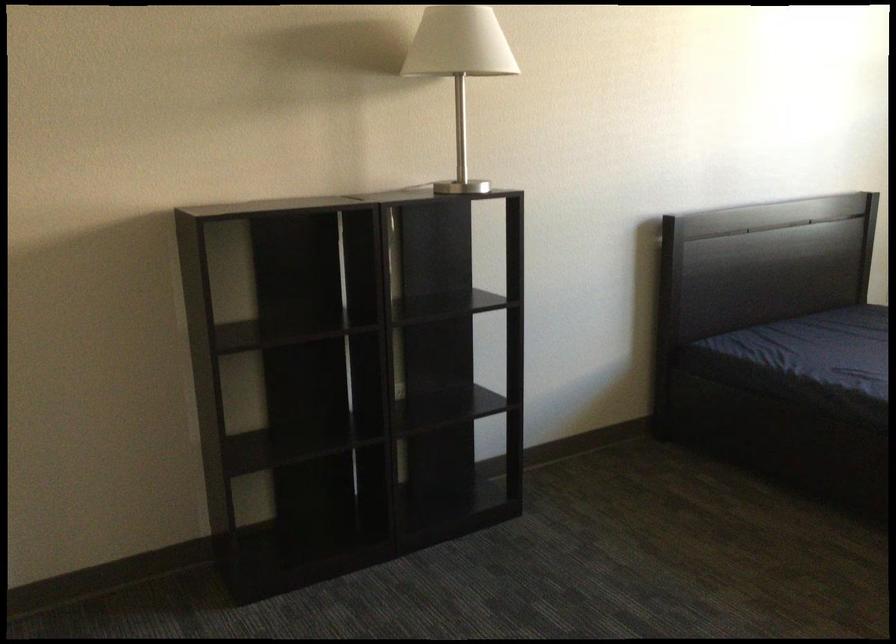
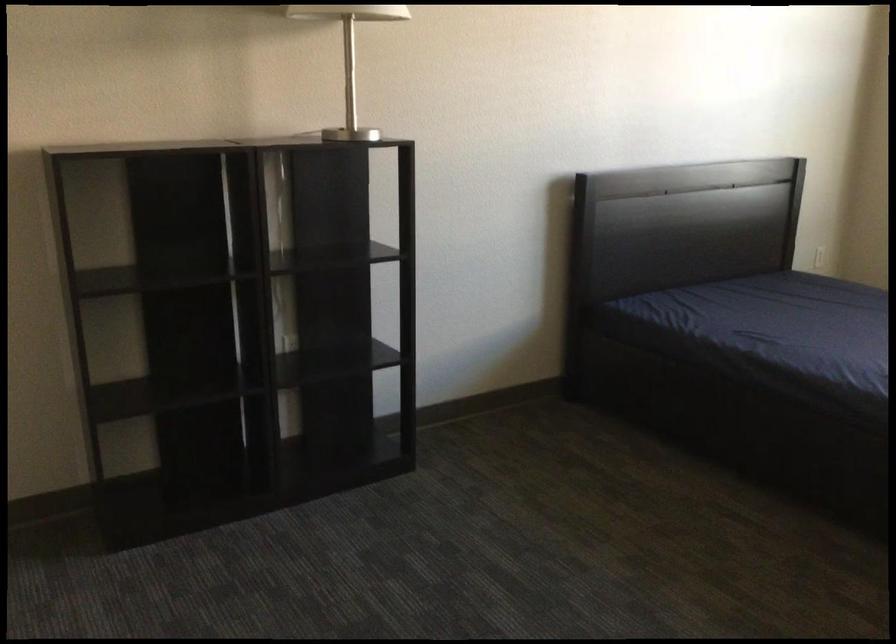
Question: Based on the continuous images, in which direction is the camera rotating? Reply with the corresponding letter.

Choices:
 (A) Left
 (B) Right
 (C) Up
 (D) Down

Answer: (D)